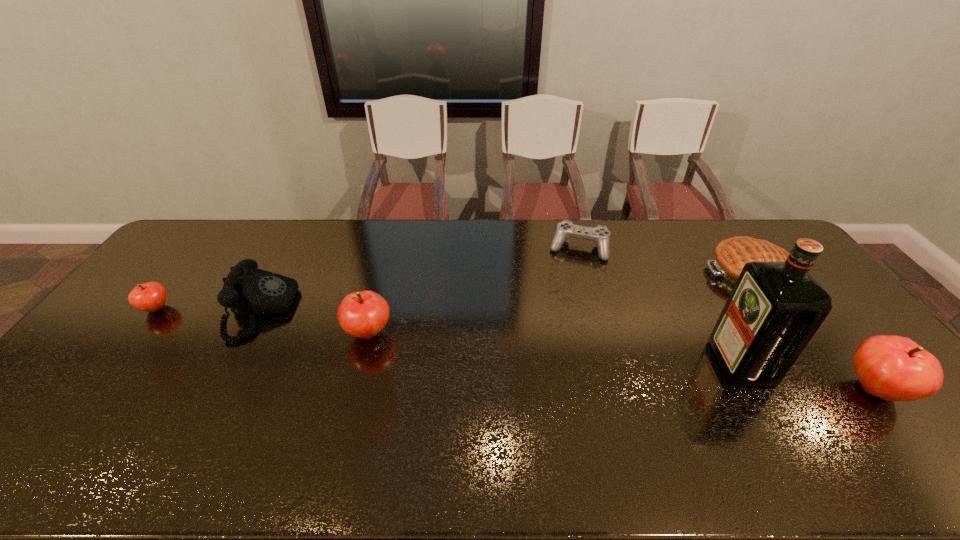
Please point a space for a new apple to maintain equal intervals. Please provide its 2D coordinates. Your answer should be formatted as a tuple, i.e. [(x, y)], where the tuple contains the x and y coordinates of a point satisfying the conditions above.

[(607, 359)]